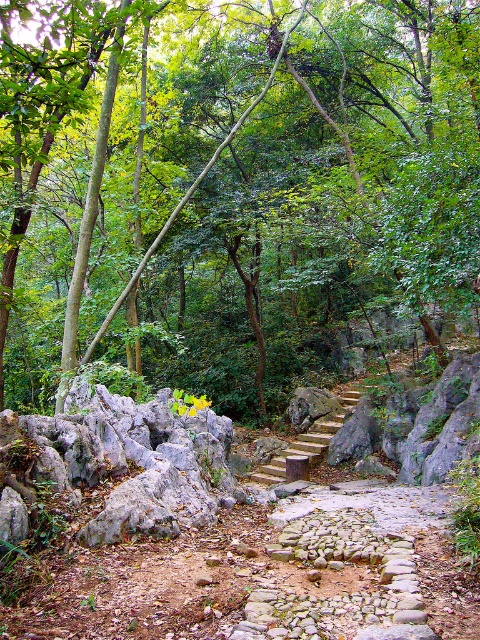
Question: Which of the following is the farthest from the observer?

Choices:
 (A) (299, 205)
 (B) (264, 467)

Answer: (B)

Question: Is green leafy tree at center below wooden stairs at center?

Choices:
 (A) yes
 (B) no

Answer: (B)

Question: Is green leafy tree at center smaller than wooden stairs at center?

Choices:
 (A) yes
 (B) no

Answer: (B)

Question: Which point appears closest to the camera in this image?

Choices:
 (A) (360, 388)
 (B) (118, 172)

Answer: (B)

Question: Can you confirm if green leafy tree at center is positioned below wooden stairs at center?

Choices:
 (A) no
 (B) yes

Answer: (A)